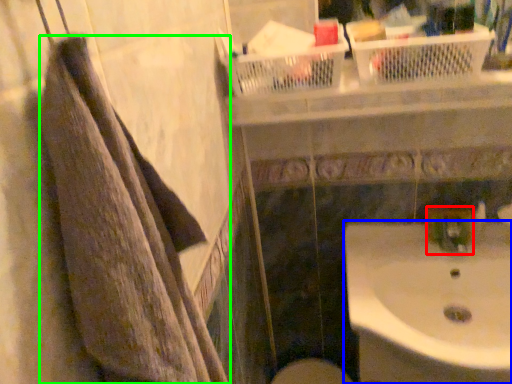
Question: Estimate the real-world distances between objects in this image. Which object is farther from plumbing fixture (highlighted by a red box), sink (highlighted by a blue box) or towel (highlighted by a green box)?

Choices:
 (A) sink
 (B) towel

Answer: (B)